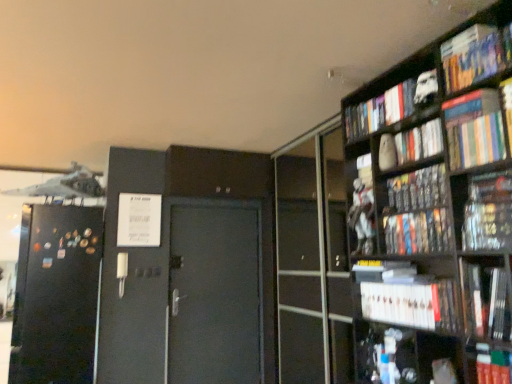
Question: From the image's perspective, is hardcover books at upper right, positioned as the 4th book in top-to-bottom order, above matte black book at upper right, placed as the fifth book when sorted from top to bottom?

Choices:
 (A) yes
 (B) no

Answer: (A)

Question: Is hardcover books at upper right, positioned as the 4th book in top-to-bottom order, facing away from matte black book at upper right, placed as the fifth book when sorted from top to bottom?

Choices:
 (A) no
 (B) yes

Answer: (A)

Question: Considering the relative sizes of hardcover books at upper right, positioned as the 4th book in top-to-bottom order, and matte black book at upper right, placed as the fifth book when sorted from top to bottom, in the image provided, is hardcover books at upper right, positioned as the 4th book in top-to-bottom order, shorter than matte black book at upper right, placed as the fifth book when sorted from top to bottom,?

Choices:
 (A) no
 (B) yes

Answer: (A)

Question: From the image's perspective, is hardcover books at upper right, which is counted as the 8th book, starting from the bottom, below matte black book at upper right, the 7th book in the bottom-to-top sequence?

Choices:
 (A) yes
 (B) no

Answer: (B)

Question: Does hardcover books at upper right, positioned as the 4th book in top-to-bottom order, have a smaller size compared to matte black book at upper right, the 7th book in the bottom-to-top sequence?

Choices:
 (A) yes
 (B) no

Answer: (A)

Question: Relative to hardcover book at right, the seventh book from the top, is white matte figurine at upper right, which ranks as the tenth book in bottom-to-top order, in front or behind?

Choices:
 (A) front
 (B) behind

Answer: (B)

Question: Is white matte figurine at upper right, the 2th book from the top, bigger or smaller than hardcover book at right, the seventh book from the top?

Choices:
 (A) big
 (B) small

Answer: (A)

Question: In terms of height, does white matte figurine at upper right, which ranks as the tenth book in bottom-to-top order, look taller or shorter compared to hardcover book at right, the seventh book from the top?

Choices:
 (A) tall
 (B) short

Answer: (A)

Question: Is white matte figurine at upper right, which ranks as the tenth book in bottom-to-top order, to the left or to the right of hardcover book at right, the seventh book from the top, in the image?

Choices:
 (A) right
 (B) left

Answer: (B)

Question: In the image, is matte black book at upper right, the 7th book in the bottom-to-top sequence, on the left side or the right side of white matte figurine at upper right, the 2th book from the top?

Choices:
 (A) right
 (B) left

Answer: (A)

Question: From a real-world perspective, is matte black book at upper right, placed as the fifth book when sorted from top to bottom, positioned above or below white matte figurine at upper right, which ranks as the tenth book in bottom-to-top order?

Choices:
 (A) above
 (B) below

Answer: (B)

Question: From the image's perspective, relative to white matte figurine at upper right, the 2th book from the top, is matte black book at upper right, placed as the fifth book when sorted from top to bottom, above or below?

Choices:
 (A) above
 (B) below

Answer: (B)

Question: Is matte black book at upper right, the 7th book in the bottom-to-top sequence, wider or thinner than white matte figurine at upper right, the 2th book from the top?

Choices:
 (A) wide
 (B) thin

Answer: (B)

Question: Considering the positions of hardcover book at lower right, positioned as the 11th book in top-to-bottom order, and white matte bookshelf at lower right, which is counted as the tenth book, starting from the top, in the image, is hardcover book at lower right, positioned as the 11th book in top-to-bottom order, wider or thinner than white matte bookshelf at lower right, which is counted as the tenth book, starting from the top,?

Choices:
 (A) thin
 (B) wide

Answer: (A)

Question: Choose the correct answer: Is hardcover book at lower right, the first book positioned from the bottom, inside white matte bookshelf at lower right, the 2th book ordered from the bottom, or outside it?

Choices:
 (A) outside
 (B) inside

Answer: (A)